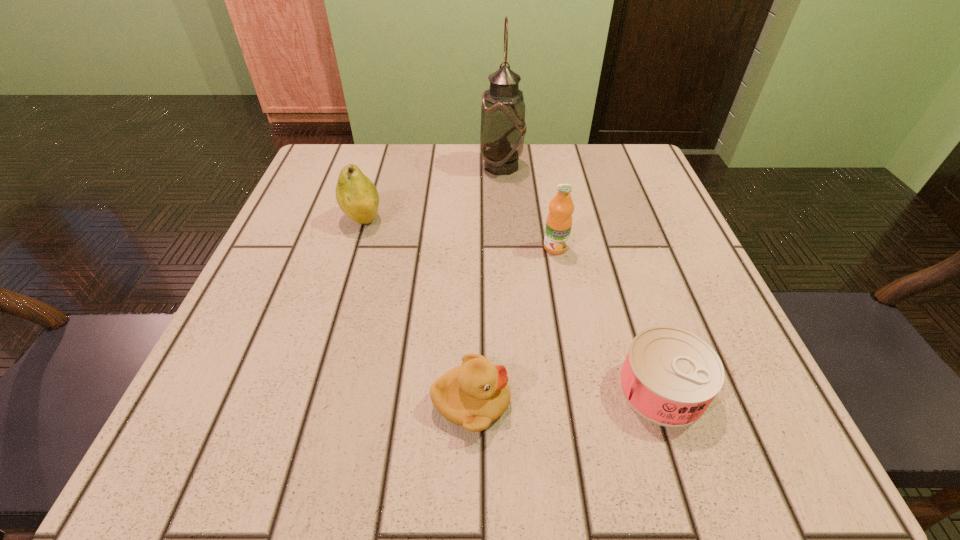
Find the location of `free location at the far edge`. free location at the far edge is located at coordinates (458, 149).

Locate an element on the screen. The width and height of the screenshot is (960, 540). vacant area at the near edge is located at coordinates (324, 413).

Where is `vacant region at the left edge of the desktop`? vacant region at the left edge of the desktop is located at coordinates (341, 255).

Find the location of a particular element. vacant region at the right edge of the desktop is located at coordinates (650, 291).

Image resolution: width=960 pixels, height=540 pixels. Find the location of `blank space at the far left corner of the desktop`. blank space at the far left corner of the desktop is located at coordinates (330, 168).

This screenshot has width=960, height=540. What are the coordinates of `free space at the far right corner` in the screenshot? It's located at (629, 147).

At what (x,y) coordinates should I click in order to perform the action: click on vacant space in between the farthest object and the shortest object. Please return your answer as a coordinate pair (x, y). The width and height of the screenshot is (960, 540). Looking at the image, I should click on (582, 277).

I want to click on vacant region between the duckling and the farthest object, so click(487, 284).

You are a GUI agent. You are given a task and a screenshot of the screen. Output one action in this format:
    pyautogui.click(x=<x>, y=<y>)
    Task: Click on the unoccupied position between the rightmost object and the second shortest object
    
    Given the screenshot: What is the action you would take?
    pyautogui.click(x=566, y=395)

Identify the location of vacant space in between the duckling and the farthest object. (487, 284).